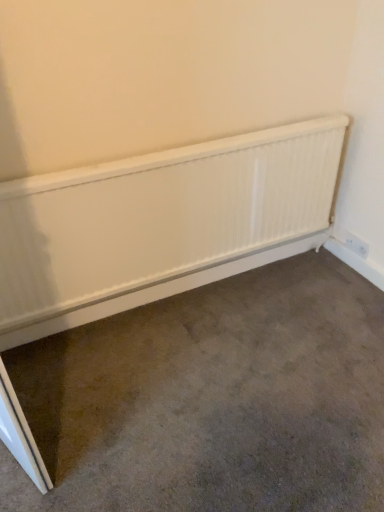
Question: From the image's perspective, is white plastic electric outlet at lower right located beneath white matte radiator at center?

Choices:
 (A) no
 (B) yes

Answer: (A)

Question: Is white plastic electric outlet at lower right closer to the viewer compared to white matte radiator at center?

Choices:
 (A) no
 (B) yes

Answer: (A)

Question: Is white plastic electric outlet at lower right bigger than white matte radiator at center?

Choices:
 (A) no
 (B) yes

Answer: (A)

Question: Are white plastic electric outlet at lower right and white matte radiator at center far apart?

Choices:
 (A) yes
 (B) no

Answer: (A)

Question: Is white plastic electric outlet at lower right placed right next to white matte radiator at center?

Choices:
 (A) no
 (B) yes

Answer: (A)

Question: In terms of width, does white plastic electric outlet at lower right look wider or thinner when compared to white matte radiator at center?

Choices:
 (A) thin
 (B) wide

Answer: (A)

Question: Choose the correct answer: Is white plastic electric outlet at lower right inside white matte radiator at center or outside it?

Choices:
 (A) outside
 (B) inside

Answer: (A)

Question: Does point (364, 254) appear closer or farther from the camera than point (367, 430)?

Choices:
 (A) closer
 (B) farther

Answer: (B)

Question: From the image's perspective, is white plastic electric outlet at lower right above or below white matte radiator at center?

Choices:
 (A) above
 (B) below

Answer: (A)

Question: From a real-world perspective, is white plastic electric outlet at lower right above or below white textured radiator at center?

Choices:
 (A) below
 (B) above

Answer: (A)

Question: Is white plastic electric outlet at lower right wider or thinner than white textured radiator at center?

Choices:
 (A) wide
 (B) thin

Answer: (B)

Question: In the image, is white plastic electric outlet at lower right positioned in front of or behind white textured radiator at center?

Choices:
 (A) behind
 (B) front

Answer: (A)

Question: Considering the positions of point 357,252 and point 208,153, is point 357,252 closer or farther from the camera than point 208,153?

Choices:
 (A) farther
 (B) closer

Answer: (A)

Question: Is white matte radiator at center bigger or smaller than white plastic electric outlet at lower right?

Choices:
 (A) small
 (B) big

Answer: (B)

Question: From a real-world perspective, is white matte radiator at center above or below white plastic electric outlet at lower right?

Choices:
 (A) above
 (B) below

Answer: (B)